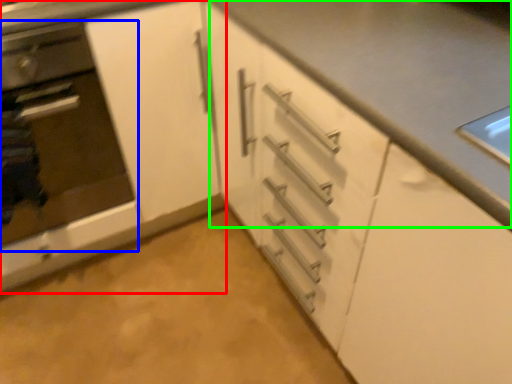
Question: Based on their relative distances, which object is nearer to cabinetry (highlighted by a red box)? Choose from oven (highlighted by a blue box) and counter top (highlighted by a green box).

Choices:
 (A) oven
 (B) counter top

Answer: (A)